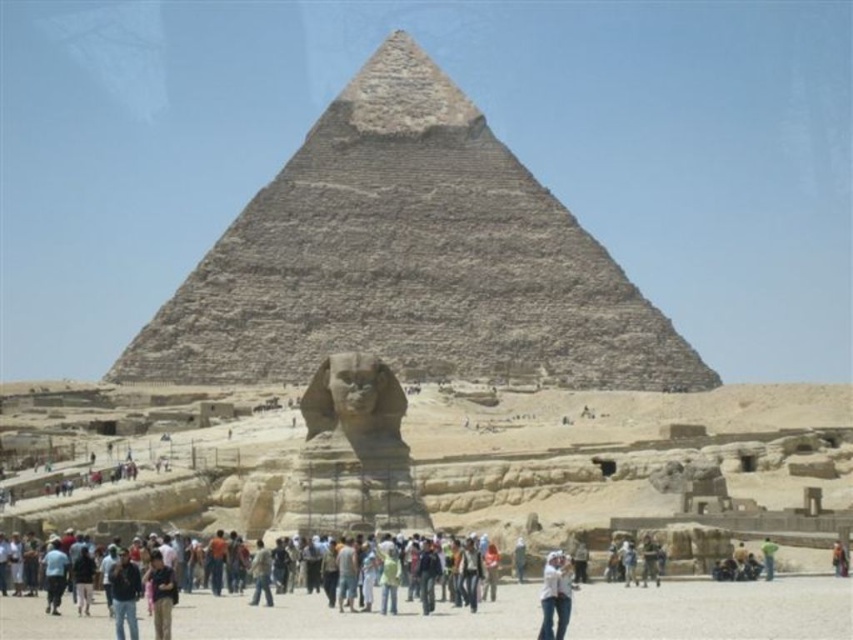
You are a tourist visiting the Great Pyramid of Giza. You notice a dark blue shirt at lower left and the granite pyramid at center in your view. From your current position, which object is closer to you?

The dark blue shirt at lower left is behind the granite pyramid at center, so the granite pyramid at center is closer to you.

You are a tourist visiting the Great Pyramid of Giza. You notice a granite pyramid at center and a dark blue shirt at lower left. Which object is bigger in size?

The granite pyramid at center is larger in size compared to the dark blue shirt at lower left according to the description.

You are a tourist standing at the base of the granite pyramid at center. You want to take a photo of the pyramid with your smartphone, which has a maximum zoom range of 100 meters. Can you capture the entire pyramid in your photo without moving closer?

The granite pyramid at center is 507.19 meters away from the camera. Since your smartphone can only zoom up to 100 meters, you cannot capture the entire pyramid in your photo without moving closer.